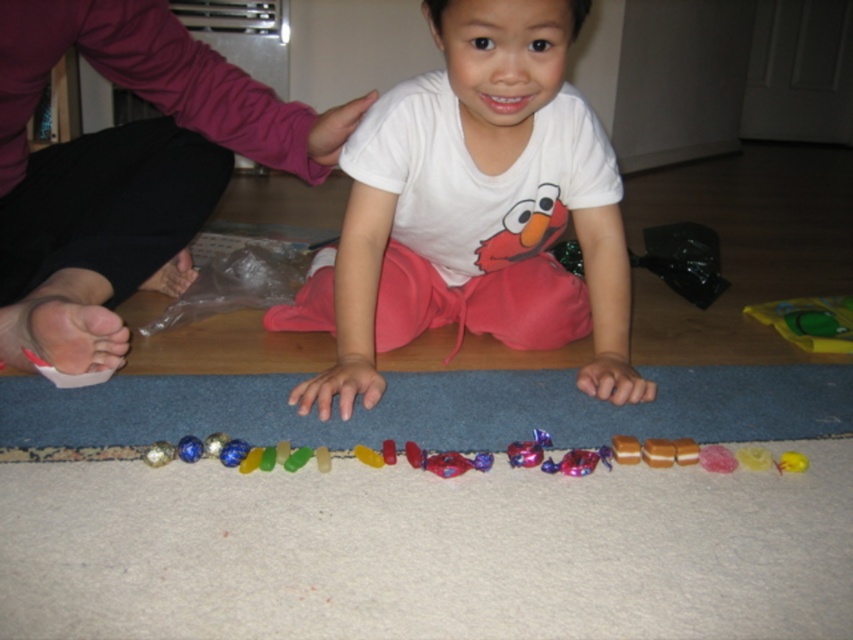
Question: Does white cotton toddler at center appear on the left side of pink fabric at upper center?

Choices:
 (A) yes
 (B) no

Answer: (B)

Question: Is glossy plastic candy at center below translucent yellow candy at center?

Choices:
 (A) no
 (B) yes

Answer: (A)

Question: Which point is closer to the camera?

Choices:
 (A) glossy plastic candy at center
 (B) white cotton toddler at center
 (C) translucent yellow candy at center

Answer: (B)

Question: Among these points, which one is farthest from the camera?

Choices:
 (A) (55, 244)
 (B) (780, 461)
 (C) (258, 460)
 (D) (434, 289)

Answer: (D)

Question: Based on their relative distances, which object is farther from the translucent yellow candy at center?

Choices:
 (A) white cotton toddler at center
 (B) glossy plastic candy at center

Answer: (A)

Question: From the image, what is the correct spatial relationship of white cotton toddler at center in relation to glossy plastic candy at center?

Choices:
 (A) left
 (B) right

Answer: (B)